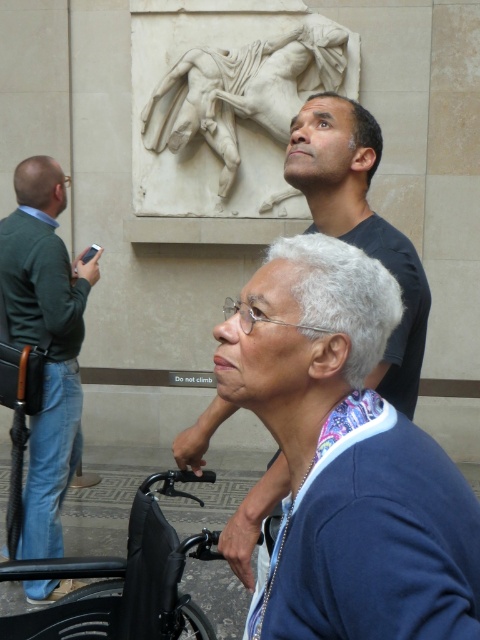
Question: Can you confirm if black matte shirt at upper center is wider than green sweater at left?

Choices:
 (A) yes
 (B) no

Answer: (B)

Question: Which point appears closest to the camera in this image?

Choices:
 (A) (305, 29)
 (B) (155, 500)

Answer: (B)

Question: From the image, what is the correct spatial relationship of black matte shirt at upper center in relation to green sweater at left?

Choices:
 (A) below
 (B) above

Answer: (B)

Question: Which point is closer to the camera taking this photo?

Choices:
 (A) (34, 316)
 (B) (204, 547)
 (C) (335, 88)

Answer: (B)

Question: Based on their relative distances, which object is nearer to the black matte shirt at upper center?

Choices:
 (A) white marble relief at upper center
 (B) black plastic wheelchair at lower left

Answer: (B)

Question: Is green sweater at left above black plastic wheelchair at lower left?

Choices:
 (A) no
 (B) yes

Answer: (B)